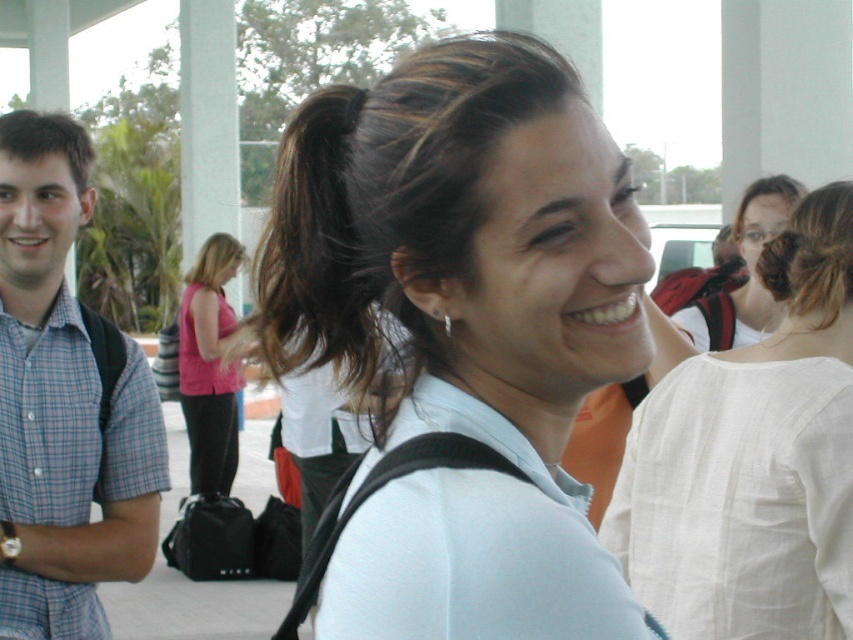
Who is more distant from viewer, (668, 621) or (796, 189)?

The point (796, 189) is behind.

Which is more to the left, white cotton blouse at upper right or matte white blouse at upper right?

Positioned to the left is white cotton blouse at upper right.

Locate an element on the screen. The image size is (853, 640). white cotton blouse at upper right is located at coordinates (752, 467).

You are a GUI agent. You are given a task and a screenshot of the screen. Output one action in this format:
    pyautogui.click(x=<x>, y=<y>)
    Task: Click on the white cotton blouse at upper right
    
    Given the screenshot: What is the action you would take?
    (x=752, y=467)

What do you see at coordinates (47, 140) in the screenshot? Image resolution: width=853 pixels, height=640 pixels. I see `brown matte hair at left` at bounding box center [47, 140].

Is brown matte hair at left to the left of blonde hair at center from the viewer's perspective?

Incorrect, brown matte hair at left is not on the left side of blonde hair at center.

Which is in front, point (65, 161) or point (229, 259)?

Point (65, 161) is more forward.

At what (x,y) coordinates should I click in order to perform the action: click on brown matte hair at left. Please return your answer as a coordinate pair (x, y). Image resolution: width=853 pixels, height=640 pixels. Looking at the image, I should click on (47, 140).

Does point (488, 534) come behind point (683, 518)?

No.

Is white matte shirt at center taller than white cotton blouse at upper right?

Incorrect, white matte shirt at center's height is not larger of white cotton blouse at upper right's.

Is point (578, 156) positioned behind point (840, 561)?

No, it is not.

Image resolution: width=853 pixels, height=640 pixels. I want to click on white matte shirt at center, so (462, 333).